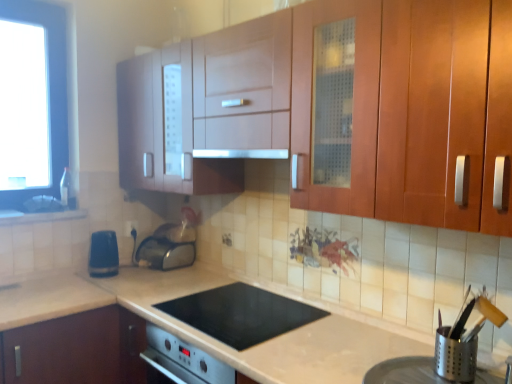
The height and width of the screenshot is (384, 512). I want to click on free location above white glossy countertop at center (from a real-world perspective), so click(243, 316).